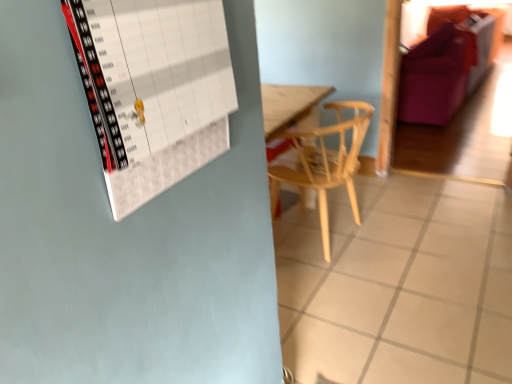
You are a GUI agent. You are given a task and a screenshot of the screen. Output one action in this format:
    pyautogui.click(x=<x>, y=<y>)
    Task: Click on the free space in front of light wood chair at center
    
    Given the screenshot: What is the action you would take?
    pyautogui.click(x=372, y=299)